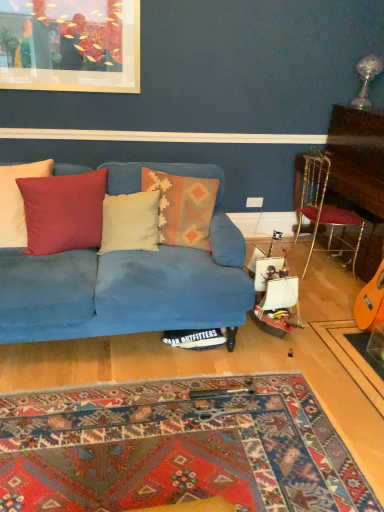
Question: From the image's perspective, is creamy soft pillow at center, arranged as the 2th pillow when viewed from the right, located beneath textured woolen pillow at center, arranged as the 1th pillow when viewed from the right?

Choices:
 (A) no
 (B) yes

Answer: (B)

Question: Is creamy soft pillow at center, arranged as the 2th pillow when viewed from the right, smaller than textured woolen pillow at center, arranged as the 1th pillow when viewed from the right?

Choices:
 (A) no
 (B) yes

Answer: (B)

Question: Is creamy soft pillow at center, arranged as the 2th pillow when viewed from the right, turned away from textured woolen pillow at center, positioned as the fourth pillow in left-to-right order?

Choices:
 (A) yes
 (B) no

Answer: (B)

Question: Is creamy soft pillow at center, marked as the 3th pillow in a left-to-right arrangement, behind textured woolen pillow at center, arranged as the 1th pillow when viewed from the right?

Choices:
 (A) yes
 (B) no

Answer: (B)

Question: Is creamy soft pillow at center, marked as the 3th pillow in a left-to-right arrangement, aimed at textured woolen pillow at center, arranged as the 1th pillow when viewed from the right?

Choices:
 (A) no
 (B) yes

Answer: (A)

Question: Which is correct: velvet blue couch at center is inside creamy soft pillow at center, arranged as the 2th pillow when viewed from the right, or outside of it?

Choices:
 (A) outside
 (B) inside

Answer: (A)

Question: In terms of size, does velvet blue couch at center appear bigger or smaller than creamy soft pillow at center, marked as the 3th pillow in a left-to-right arrangement?

Choices:
 (A) small
 (B) big

Answer: (B)

Question: In terms of width, does velvet blue couch at center look wider or thinner when compared to creamy soft pillow at center, marked as the 3th pillow in a left-to-right arrangement?

Choices:
 (A) thin
 (B) wide

Answer: (B)

Question: Does point (185, 307) appear closer or farther from the camera than point (105, 198)?

Choices:
 (A) farther
 (B) closer

Answer: (B)

Question: Choose the correct answer: Is textured woolen pillow at center, positioned as the fourth pillow in left-to-right order, inside matte red cushion at center, which ranks as the third pillow in right-to-left order, or outside it?

Choices:
 (A) outside
 (B) inside

Answer: (A)

Question: Is point (177, 244) positioned closer to the camera than point (23, 186)?

Choices:
 (A) closer
 (B) farther

Answer: (B)

Question: From a real-world perspective, is textured woolen pillow at center, positioned as the fourth pillow in left-to-right order, physically located above or below matte red cushion at center, marked as the 2th pillow in a left-to-right arrangement?

Choices:
 (A) above
 (B) below

Answer: (A)

Question: From their relative heights in the image, would you say textured woolen pillow at center, positioned as the fourth pillow in left-to-right order, is taller or shorter than matte red cushion at center, which ranks as the third pillow in right-to-left order?

Choices:
 (A) tall
 (B) short

Answer: (A)

Question: Does point (99, 198) appear closer or farther from the camera than point (258, 202)?

Choices:
 (A) closer
 (B) farther

Answer: (A)

Question: Is matte red cushion at center, which ranks as the third pillow in right-to-left order, spatially inside white plastic power outlet at upper right, or outside of it?

Choices:
 (A) outside
 (B) inside

Answer: (A)